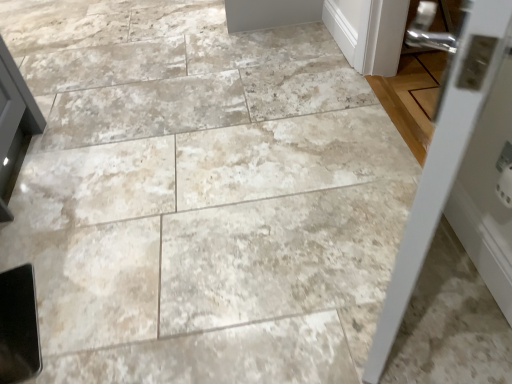
Where is `vacant area situated to the left side of white glossy door at right, acting as the first door starting from the bottom`? The width and height of the screenshot is (512, 384). vacant area situated to the left side of white glossy door at right, acting as the first door starting from the bottom is located at coordinates (266, 271).